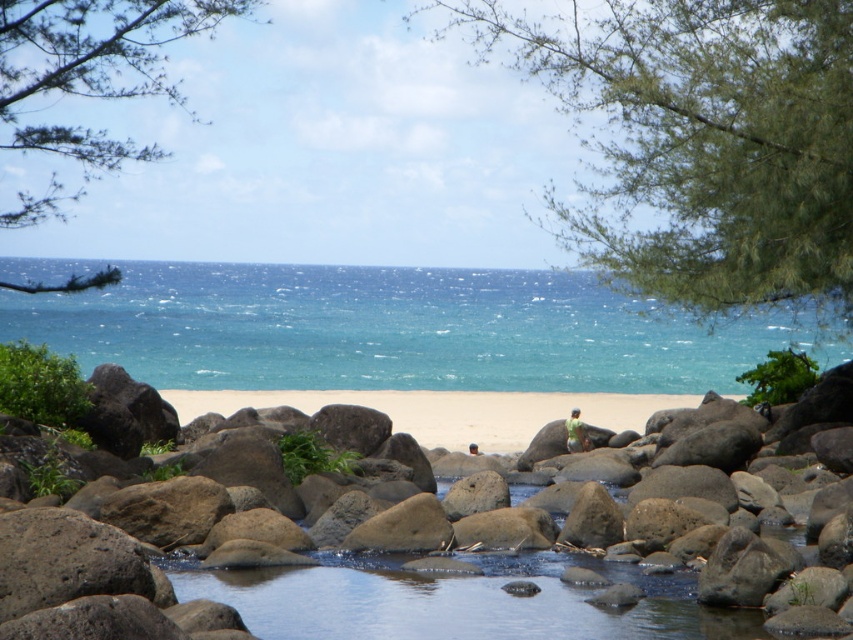
Question: Considering the real-world distances, which object is closest to the green leafy tree at upper right?

Choices:
 (A) green fabric shirt at center
 (B) blue water at center
 (C) green leafy branch at upper left
 (D) light brown wooden surfboard at center

Answer: (B)

Question: Can you confirm if green fabric shirt at center is thinner than light brown wooden surfboard at center?

Choices:
 (A) no
 (B) yes

Answer: (A)

Question: Which object is farther from the camera taking this photo?

Choices:
 (A) green leafy branch at upper left
 (B) green fabric shirt at center
 (C) light brown wooden surfboard at center
 (D) blue water at center

Answer: (B)

Question: From the image, what is the correct spatial relationship of blue water at center in relation to green fabric shirt at center?

Choices:
 (A) right
 (B) left

Answer: (B)

Question: Which point is farther to the camera?

Choices:
 (A) green leafy tree at upper right
 (B) blue water at center
 (C) light brown wooden surfboard at center
 (D) green fabric shirt at center

Answer: (D)

Question: Is green leafy tree at upper right below light brown wooden surfboard at center?

Choices:
 (A) no
 (B) yes

Answer: (A)